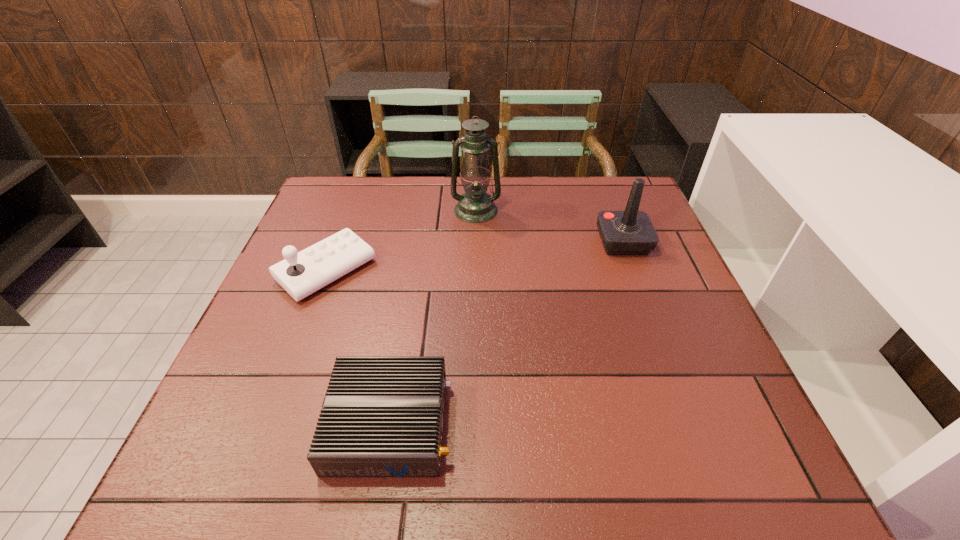
Image resolution: width=960 pixels, height=540 pixels. In order to click on the tallest object in this screenshot , I will do `click(475, 206)`.

Where is `oil lamp`? oil lamp is located at coordinates (475, 206).

Find the location of a particular element. the rightmost object is located at coordinates (631, 232).

Locate an element on the screen. Image resolution: width=960 pixels, height=540 pixels. the right joystick is located at coordinates (631, 232).

At what (x,y) coordinates should I click in order to perform the action: click on the left joystick. Please return your answer as a coordinate pair (x, y). Image resolution: width=960 pixels, height=540 pixels. Looking at the image, I should click on (302, 273).

The height and width of the screenshot is (540, 960). I want to click on the second shortest object, so click(302, 273).

You are a GUI agent. You are given a task and a screenshot of the screen. Output one action in this format:
    pyautogui.click(x=<x>, y=<y>)
    Task: Click on the shortest object
    
    Given the screenshot: What is the action you would take?
    pyautogui.click(x=382, y=416)

The image size is (960, 540). I want to click on router, so (x=382, y=416).

In order to click on vacant space located 0.100m on the right of the tallest object in this screenshot , I will do `click(535, 210)`.

Find the location of a particular element. This screenshot has width=960, height=540. free space located on the front of the second tallest object is located at coordinates (654, 323).